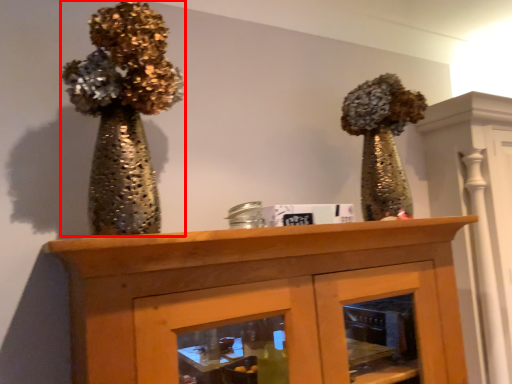
Question: From the image's perspective, where is floral arrangement (annotated by the red box) located in relation to furniture in the image?

Choices:
 (A) above
 (B) below

Answer: (A)